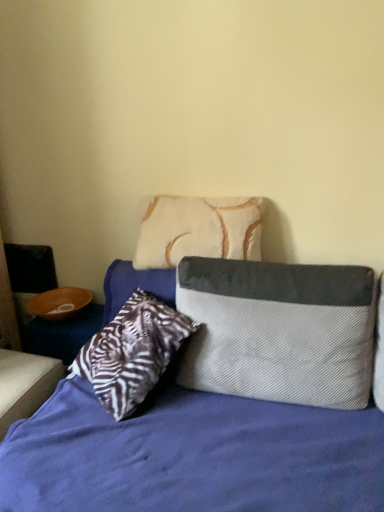
Question: Is textured gray and white pillow at center further to the viewer compared to white fur pillow at upper center, which is counted as the 2th pillow, starting from the bottom?

Choices:
 (A) no
 (B) yes

Answer: (A)

Question: Is textured gray and white pillow at center beside white fur pillow at upper center, which is counted as the 2th pillow, starting from the bottom?

Choices:
 (A) yes
 (B) no

Answer: (B)

Question: Can you confirm if textured gray and white pillow at center is smaller than white fur pillow at upper center, which is counted as the 2th pillow, starting from the bottom?

Choices:
 (A) no
 (B) yes

Answer: (A)

Question: Can you confirm if textured gray and white pillow at center is shorter than white fur pillow at upper center, which is the 1th pillow in top-to-bottom order?

Choices:
 (A) yes
 (B) no

Answer: (B)

Question: Does textured gray and white pillow at center have a lesser width compared to white fur pillow at upper center, which is counted as the 2th pillow, starting from the bottom?

Choices:
 (A) yes
 (B) no

Answer: (B)

Question: From the image's perspective, relative to textured gray pillow at center, positioned as the 2th pillow in top-to-bottom order, is textured gray and white pillow at center above or below?

Choices:
 (A) below
 (B) above

Answer: (A)

Question: Is textured gray and white pillow at center taller or shorter than textured gray pillow at center, arranged as the 1th pillow when ordered from the bottom?

Choices:
 (A) tall
 (B) short

Answer: (A)

Question: In the image, is textured gray and white pillow at center positioned in front of or behind textured gray pillow at center, positioned as the 2th pillow in top-to-bottom order?

Choices:
 (A) front
 (B) behind

Answer: (A)

Question: From a real-world perspective, relative to textured gray pillow at center, arranged as the 1th pillow when ordered from the bottom, is textured gray and white pillow at center vertically above or below?

Choices:
 (A) above
 (B) below

Answer: (B)

Question: From a real-world perspective, is white fur pillow at upper center, which is counted as the 2th pillow, starting from the bottom, positioned above or below textured gray pillow at center, positioned as the 2th pillow in top-to-bottom order?

Choices:
 (A) above
 (B) below

Answer: (A)

Question: From the image's perspective, is white fur pillow at upper center, which is counted as the 2th pillow, starting from the bottom, above or below textured gray pillow at center, positioned as the 2th pillow in top-to-bottom order?

Choices:
 (A) below
 (B) above

Answer: (B)

Question: Is white fur pillow at upper center, which is the 1th pillow in top-to-bottom order, wider or thinner than textured gray pillow at center, positioned as the 2th pillow in top-to-bottom order?

Choices:
 (A) thin
 (B) wide

Answer: (A)

Question: Which is correct: white fur pillow at upper center, which is the 1th pillow in top-to-bottom order, is inside textured gray pillow at center, arranged as the 1th pillow when ordered from the bottom, or outside of it?

Choices:
 (A) outside
 (B) inside

Answer: (A)

Question: Looking at their shapes, would you say textured gray and white pillow at center is wider or thinner than white fur pillow at upper center, which is counted as the 2th pillow, starting from the bottom?

Choices:
 (A) thin
 (B) wide

Answer: (B)

Question: From their relative heights in the image, would you say textured gray and white pillow at center is taller or shorter than white fur pillow at upper center, which is the 1th pillow in top-to-bottom order?

Choices:
 (A) tall
 (B) short

Answer: (A)